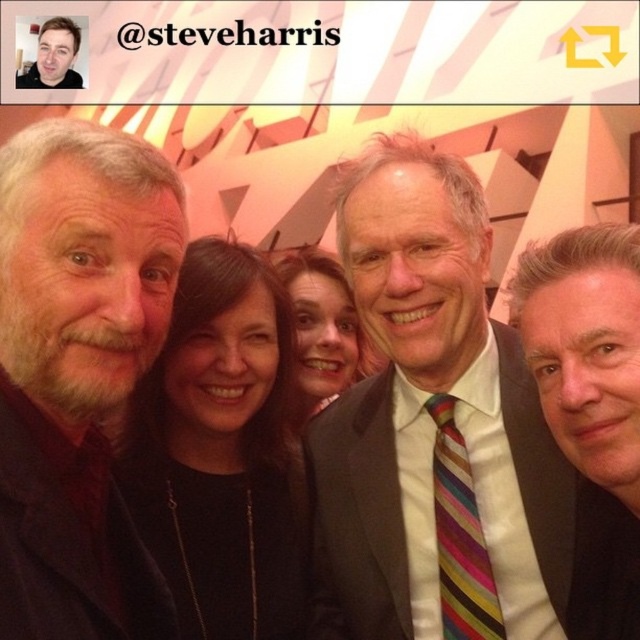
Looking at the photo, where is the striped tie at center in relation to the matte black jacket at upper left?

The striped tie at center is to the right of the matte black jacket at upper left.

You are a photographer adjusting the camera settings to ensure all subjects are in focus. Considering the striped tie at center and the matte black jacket at upper left, which object should you focus on first to ensure both are sharp?

The striped tie at center is taller than the matte black jacket at upper left, so focusing on the striped tie at center first will help ensure both are in focus as it is the taller object.

You are a photographer adjusting the lighting for a group photo. You notice the smooth black suit at center and the matte black hair at center. Which object should you focus on to ensure proper exposure since it is positioned lower in the frame?

The smooth black suit at center is located below matte black hair at center, so you should focus on the smooth black suit at center to ensure proper exposure since it is positioned lower in the frame.